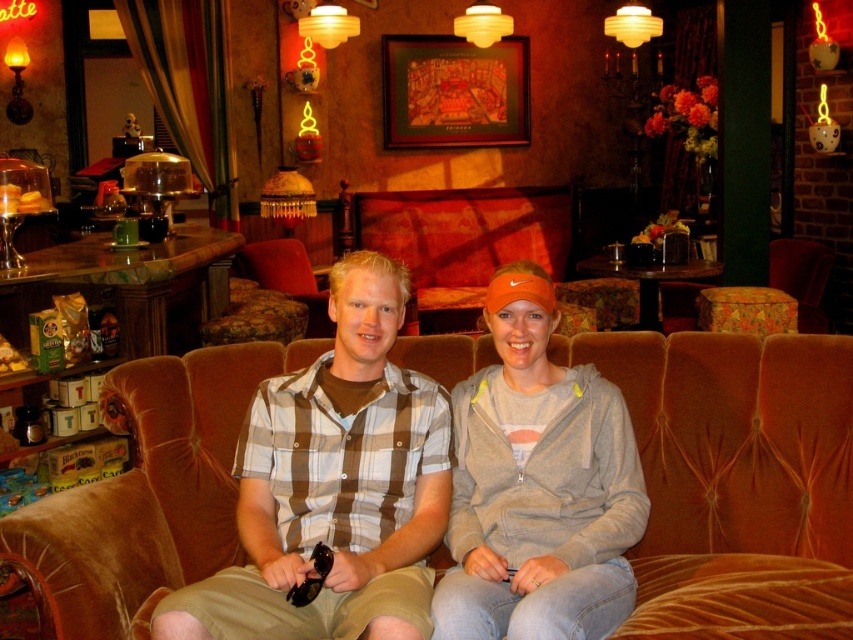
Question: Among these objects, which one is nearest to the camera?

Choices:
 (A) gray fleece sweatshirt at center
 (B) velvet brown couch at center
 (C) plaid shirt at center

Answer: (C)

Question: Which point is farther to the camera?

Choices:
 (A) (624, 579)
 (B) (207, 618)

Answer: (A)

Question: Does velvet brown couch at center appear under gray fleece sweatshirt at center?

Choices:
 (A) yes
 (B) no

Answer: (A)

Question: Does plaid shirt at center have a larger size compared to gray fleece sweatshirt at center?

Choices:
 (A) yes
 (B) no

Answer: (A)

Question: Is plaid shirt at center smaller than gray fleece sweatshirt at center?

Choices:
 (A) yes
 (B) no

Answer: (B)

Question: Estimate the real-world distances between objects in this image. Which object is farther from the gray fleece sweatshirt at center?

Choices:
 (A) velvet brown couch at center
 (B) plaid shirt at center

Answer: (A)